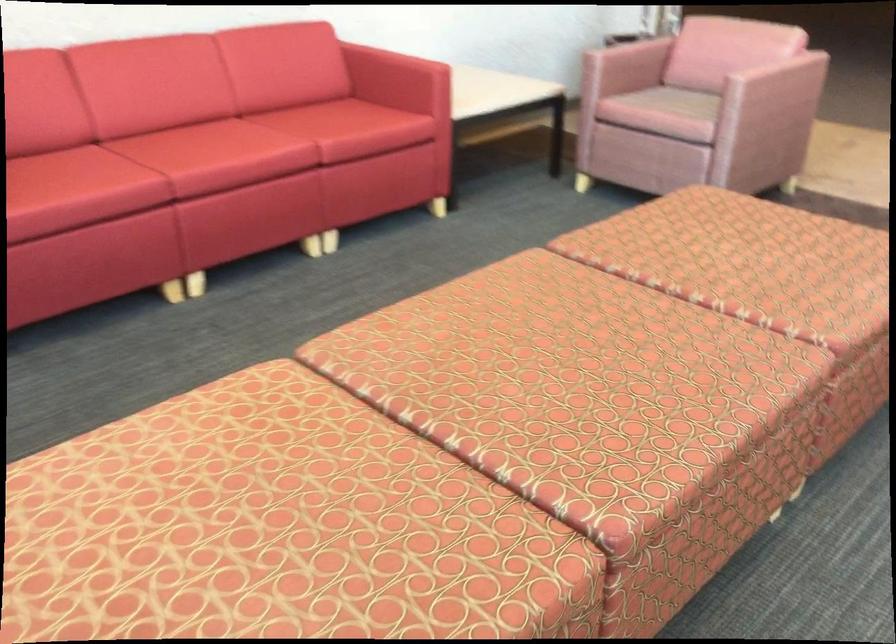
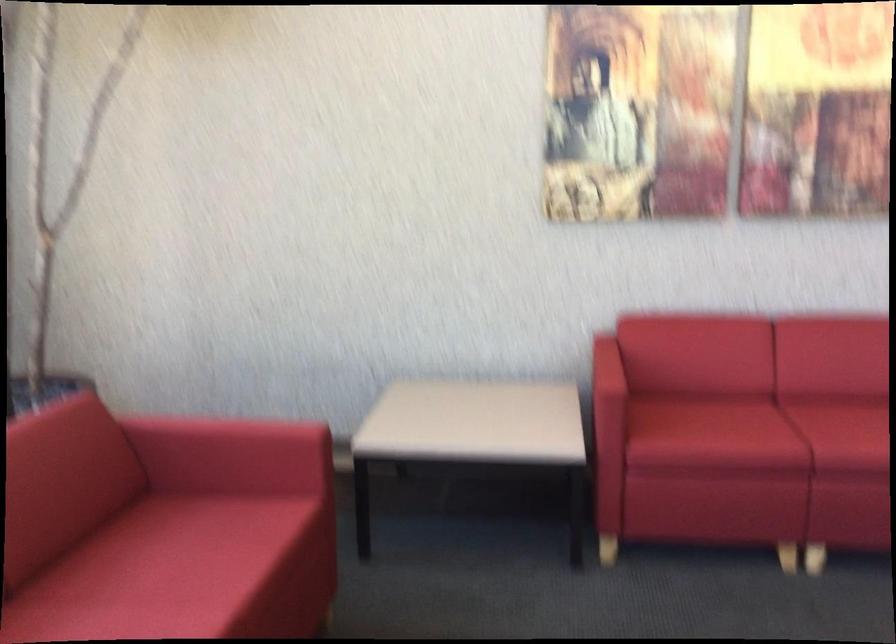
Question: The camera is either moving clockwise (left) or counter-clockwise (right) around the object. The first image is from the beginning of the video and the second image is from the end. Is the camera moving left or right when shooting the video?

Choices:
 (A) Left
 (B) Right

Answer: (B)